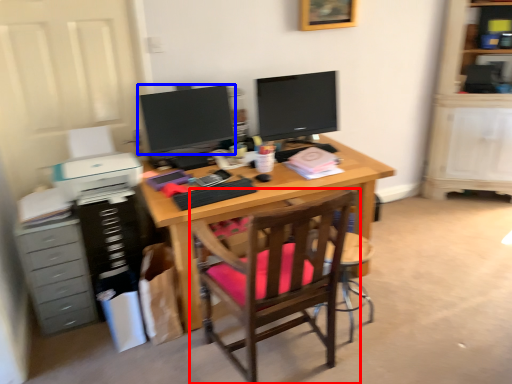
Question: Which of the following is the farthest to the observer, chair (highlighted by a red box) or television (highlighted by a blue box)?

Choices:
 (A) chair
 (B) television

Answer: (B)